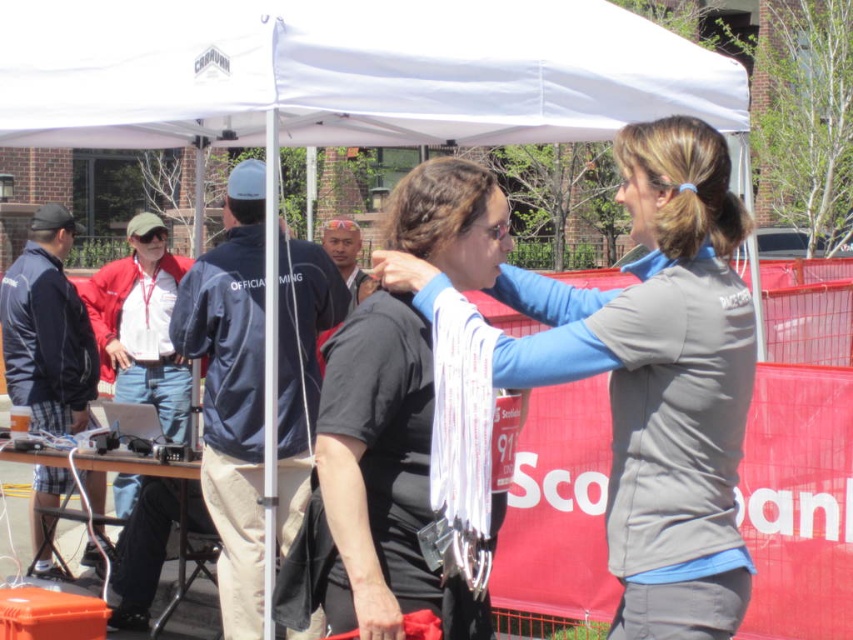
You are standing at the registration table and want to move towards the exit located at point (x=201, y=490). There is an obstacle at point (x=740, y=554). Can you walk directly to the exit without going around the obstacle?

Point (x=740, y=554) is in front of point (x=201, y=490), so the obstacle is between you and the exit. You will need to go around the obstacle to reach the exit.

You are at a community event and see two jackets. The gray fabric jacket at center and the dark blue jacket at left. Which jacket is bigger?

The gray fabric jacket at center is larger in size than the dark blue jacket at left.

Based on the photo, you are a photographer at the event and want to take a group photo of the two women. Since the gray fabric jacket at center and navy blue fleece jacket at left are important to include, which jacket should you position closer to the front to ensure both are fully visible?

The gray fabric jacket at center is shorter than the navy blue fleece jacket at left, so positioning the gray fabric jacket at center closer to the front will ensure both are fully visible.